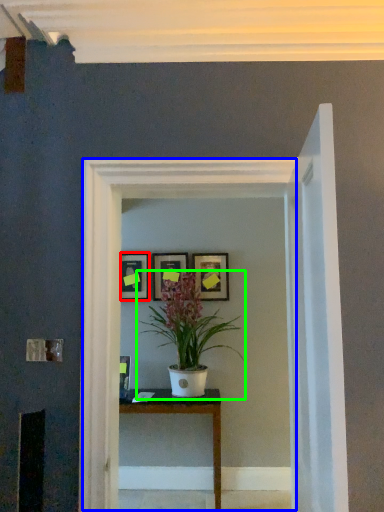
Question: Estimate the real-world distances between objects in this image. Which object is farther from picture frame (highlighted by a red box), glass door (highlighted by a blue box) or houseplant (highlighted by a green box)?

Choices:
 (A) glass door
 (B) houseplant

Answer: (A)